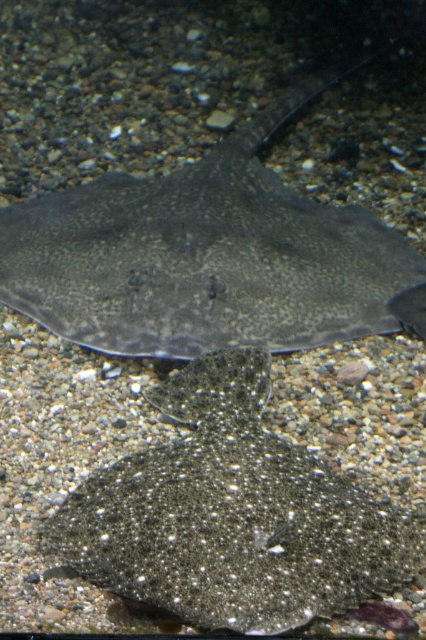
From the picture: Who is lower down, dark gray textured stingray at center or speckled matte flatfish at center?

speckled matte flatfish at center

Is dark gray textured stingray at center closer to the viewer compared to speckled matte flatfish at center?

No.

The image size is (426, 640). What do you see at coordinates (210, 256) in the screenshot? I see `dark gray textured stingray at center` at bounding box center [210, 256].

This screenshot has width=426, height=640. I want to click on dark gray textured stingray at center, so click(x=210, y=256).